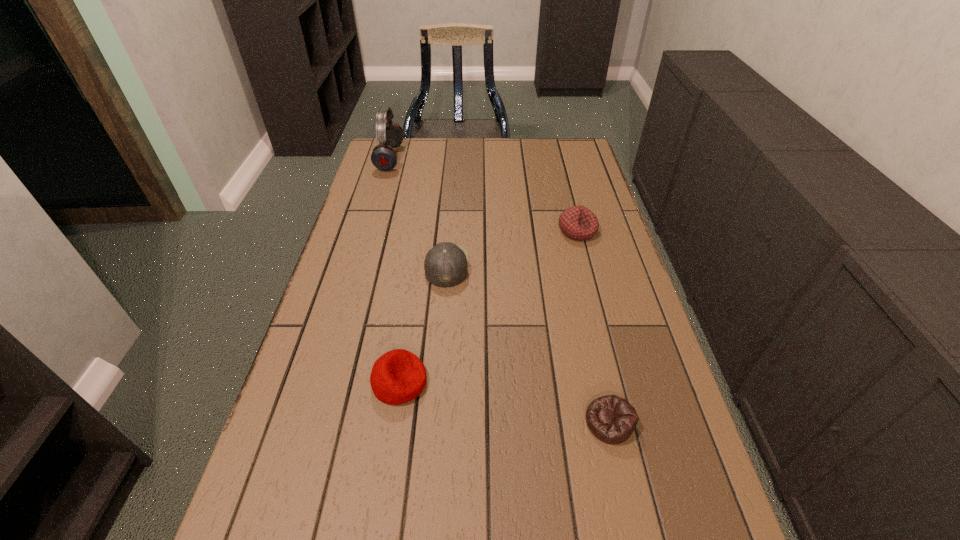
The image size is (960, 540). Identify the location of the tallest object. (384, 157).

Locate an element on the screen. This screenshot has width=960, height=540. earphone is located at coordinates (384, 157).

Find the location of a particular element. This screenshot has width=960, height=540. the third nearest object is located at coordinates (446, 264).

Find the location of a particular element. The width and height of the screenshot is (960, 540). the fourth nearest object is located at coordinates (579, 223).

I want to click on the leftmost beanbag, so click(x=398, y=376).

Find the location of a particular element. The image size is (960, 540). the shortest object is located at coordinates (612, 419).

This screenshot has height=540, width=960. I want to click on free space located 0.140m on the ear cups of the leftmost object, so click(440, 158).

The height and width of the screenshot is (540, 960). In order to click on free location located on the brim of the cap in this screenshot , I will do `click(567, 266)`.

The width and height of the screenshot is (960, 540). I want to click on free region located on the back of the farthest beanbag, so click(566, 189).

The image size is (960, 540). I want to click on free space located 0.330m on the seat area of the leftmost beanbag, so click(582, 382).